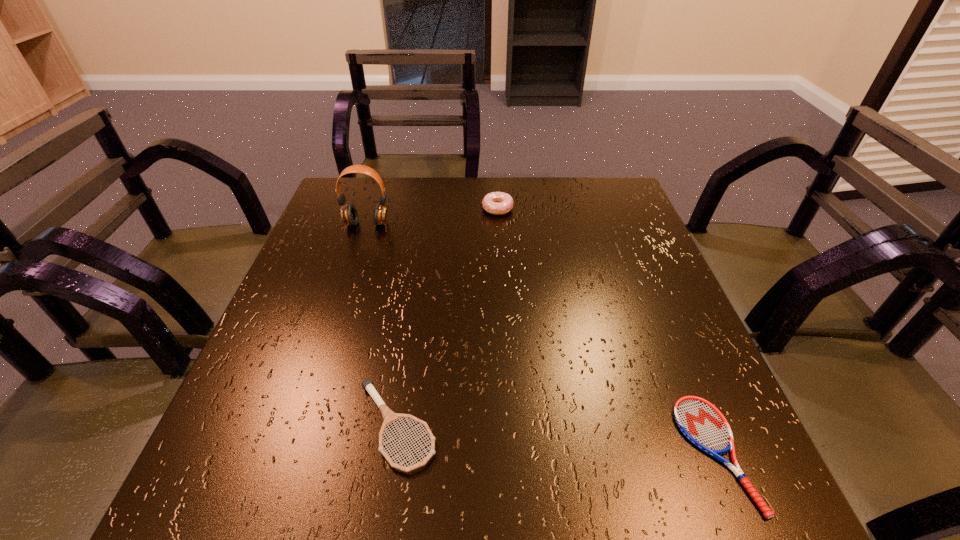
The height and width of the screenshot is (540, 960). In order to click on headset in this screenshot , I will do `click(349, 215)`.

Find the location of `the tallest object`. the tallest object is located at coordinates (349, 215).

Find the location of `the third shortest object`. the third shortest object is located at coordinates (498, 203).

Identify the location of the second object from right to left. (498, 203).

The width and height of the screenshot is (960, 540). I want to click on the taller tennis racket, so click(x=389, y=416).

Where is `the second object from left to right`? Image resolution: width=960 pixels, height=540 pixels. the second object from left to right is located at coordinates (389, 416).

What are the coordinates of `the rightmost object` in the screenshot? It's located at pyautogui.click(x=700, y=421).

This screenshot has width=960, height=540. Identify the location of the shorter tennis racket. (700, 421).

You are a GUI agent. You are given a task and a screenshot of the screen. Output one action in this format:
    pyautogui.click(x=<x>, y=<y>)
    Task: Click on the free space located on the ear cups of the headset
    This screenshot has height=540, width=960.
    Given the screenshot: What is the action you would take?
    pyautogui.click(x=359, y=247)

I want to click on free point located on the right of the doughnut, so click(532, 208).